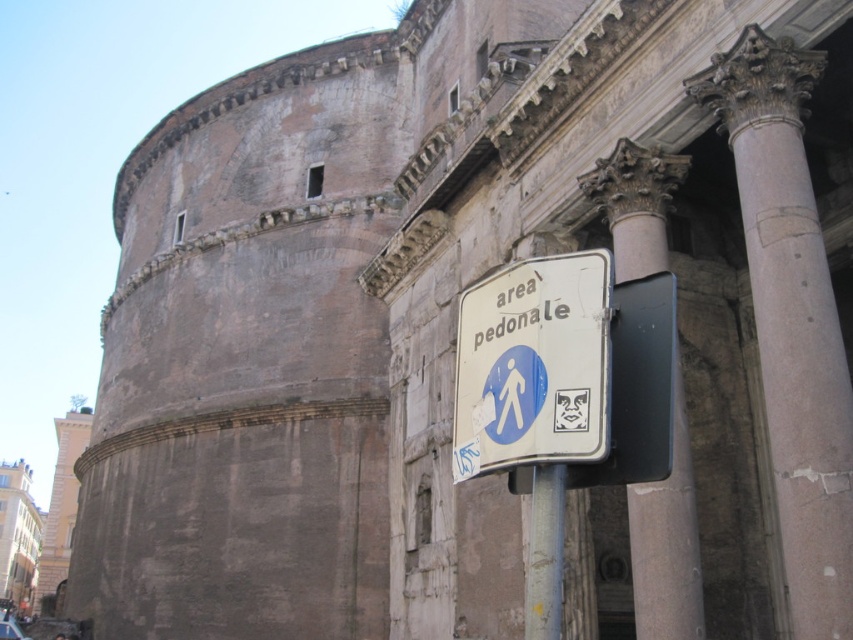
Is point (637, 156) farther from viewer compared to point (560, 545)?

Yes, point (637, 156) is behind point (560, 545).

Between marble column at center and metallic pole at lower center, which one appears on the left side from the viewer's perspective?

Positioned to the left is metallic pole at lower center.

What do you see at coordinates (666, 544) in the screenshot? Image resolution: width=853 pixels, height=640 pixels. I see `marble column at center` at bounding box center [666, 544].

The image size is (853, 640). Find the location of `marble column at center`. marble column at center is located at coordinates click(x=666, y=544).

Looking at this image, who is higher up, white paper sign at center or light beige stone tower at left?

white paper sign at center

This screenshot has height=640, width=853. I want to click on white paper sign at center, so click(x=532, y=365).

Between marble column at center and light beige stone tower at left, which one has less height?

marble column at center is shorter.

Is point (648, 634) less distant than point (51, 525)?

Yes.

Which is behind, point (619, 145) or point (47, 561)?

Point (47, 561)

The image size is (853, 640). I want to click on marble column at center, so click(666, 544).